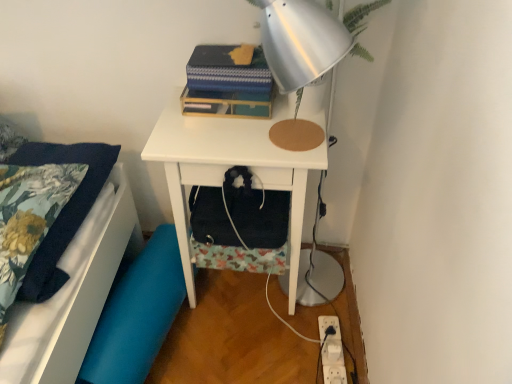
I want to click on free space above blue fabric swivel chair at lower left (from a real-world perspective), so click(129, 305).